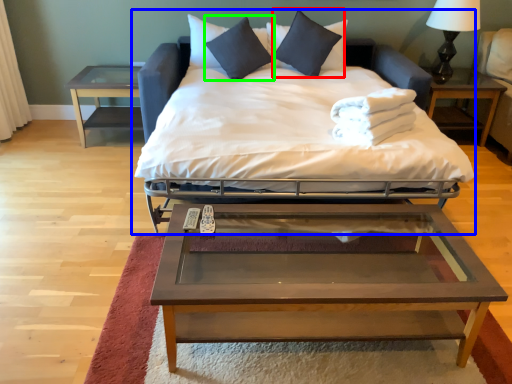
Question: Which object is positioned farthest from pillow (highlighted by a red box)? Select from bed (highlighted by a blue box) and pillow (highlighted by a green box).

Choices:
 (A) bed
 (B) pillow

Answer: (A)